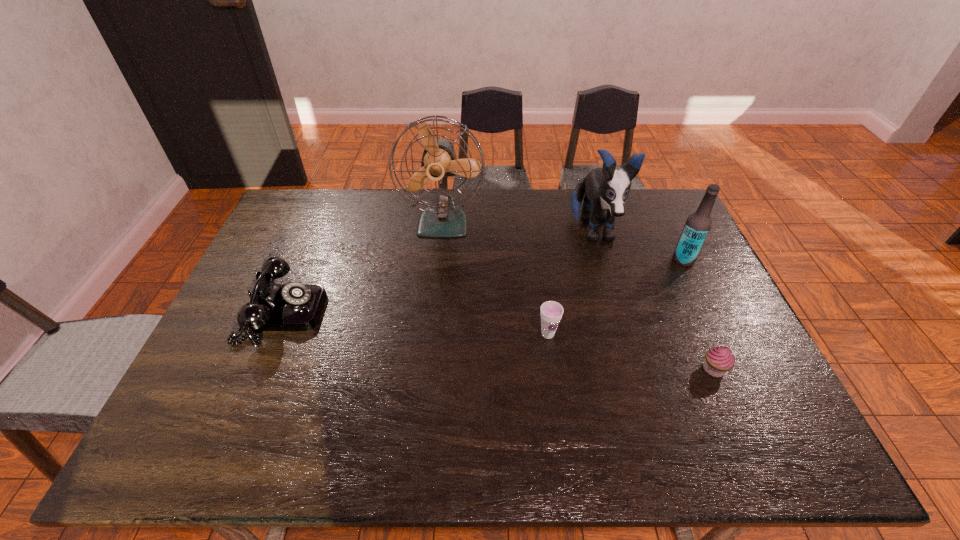
The image size is (960, 540). Identify the location of free space between the leftmost object and the nearest object. (498, 341).

You are a GUI agent. You are given a task and a screenshot of the screen. Output one action in this format:
    pyautogui.click(x=<x>, y=<y>)
    Task: Click on the empty space that is in between the leftmost object and the nearest object
    Image resolution: width=960 pixels, height=540 pixels.
    Given the screenshot: What is the action you would take?
    pyautogui.click(x=498, y=341)

In order to click on empty location between the fourth shortest object and the puppy in this screenshot , I will do `click(637, 246)`.

This screenshot has width=960, height=540. What are the coordinates of `vacant point located between the cupcake and the puppy` in the screenshot? It's located at (653, 300).

Find the location of a particular element. The image size is (960, 540). object that stands as the closest to the fourth object from left to right is located at coordinates (698, 224).

Where is `object identified as the fifth closest to the third object from left to right`? The image size is (960, 540). object identified as the fifth closest to the third object from left to right is located at coordinates (294, 306).

Image resolution: width=960 pixels, height=540 pixels. Identify the location of free location that satisfies the following two spatial constraints: 1. on the front-facing side of the puppy; 2. on the right side of the nearest object. (632, 369).

Find the location of a particular element. Image resolution: width=960 pixels, height=540 pixels. free region that satisfies the following two spatial constraints: 1. on the dial of the nearest object; 2. on the left side of the telephone is located at coordinates (259, 369).

Where is `vacant space that satisfies the following two spatial constraints: 1. on the front-facing side of the third object from right to left; 2. on the dial of the third shortest object`? This screenshot has width=960, height=540. vacant space that satisfies the following two spatial constraints: 1. on the front-facing side of the third object from right to left; 2. on the dial of the third shortest object is located at coordinates (616, 313).

Where is `vacant area in the image that satisfies the following two spatial constraints: 1. on the dial of the third shortest object; 2. on the back side of the cup`? vacant area in the image that satisfies the following two spatial constraints: 1. on the dial of the third shortest object; 2. on the back side of the cup is located at coordinates (274, 334).